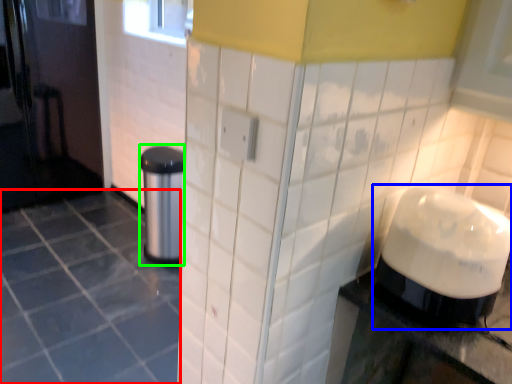
Question: Based on their relative distances, which object is nearer to ceramic tile (highlighted by a red box)? Choose from blender (highlighted by a blue box) and appliance (highlighted by a green box).

Choices:
 (A) blender
 (B) appliance

Answer: (B)